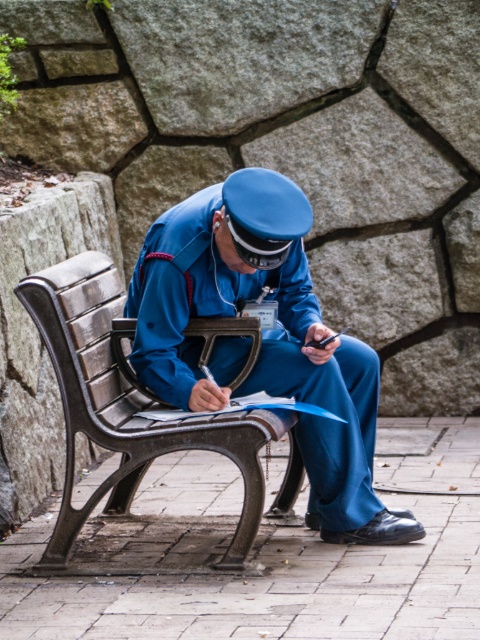
Question: Which point is farther to the camera?

Choices:
 (A) blue uniform at center
 (B) wooden bench at center

Answer: (B)

Question: Which point appears farthest from the camera in this image?

Choices:
 (A) (311, 362)
 (B) (216, 433)

Answer: (A)

Question: Can you confirm if blue uniform at center is positioned above wooden bench at center?

Choices:
 (A) no
 (B) yes

Answer: (B)

Question: Can you confirm if blue uniform at center is positioned to the right of wooden bench at center?

Choices:
 (A) no
 (B) yes

Answer: (B)

Question: Is the position of blue uniform at center less distant than that of wooden bench at center?

Choices:
 (A) yes
 (B) no

Answer: (A)